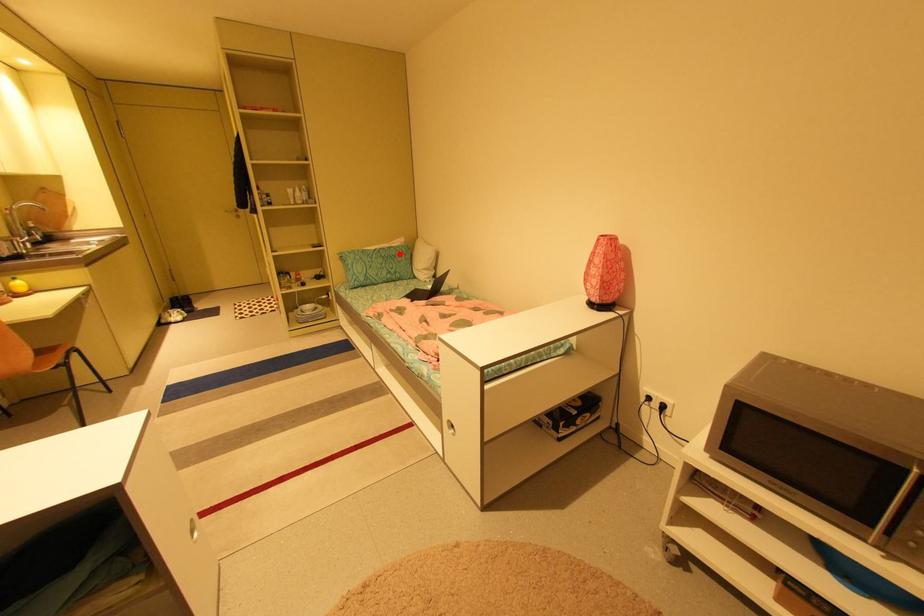
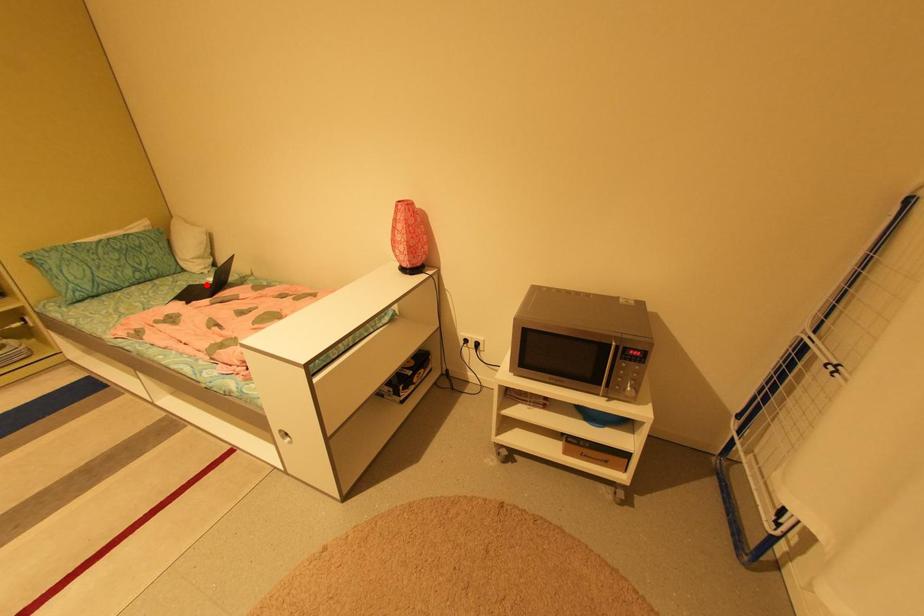
I am providing you with two images of the same scene from different viewpoints. A red point is marked on the first image and another point is marked on the second image. Do the highlighted points in image1 and image2 indicate the same real-world spot?

No